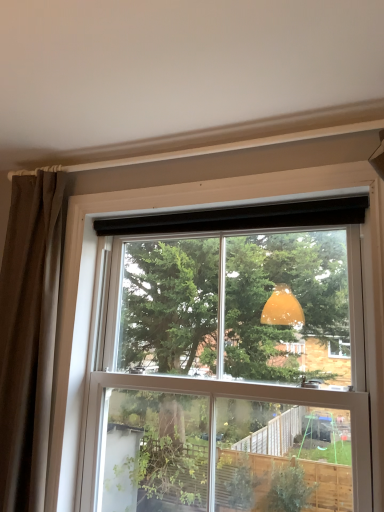
The width and height of the screenshot is (384, 512). I want to click on brown fabric curtain at left, so click(29, 334).

What do you see at coordinates (29, 334) in the screenshot? Image resolution: width=384 pixels, height=512 pixels. I see `brown fabric curtain at left` at bounding box center [29, 334].

Image resolution: width=384 pixels, height=512 pixels. What are the coordinates of `transparent glass window at upper center` in the screenshot? It's located at (179, 325).

What is the approximate width of transparent glass window at upper center?

transparent glass window at upper center is 26.08 centimeters in width.

This screenshot has width=384, height=512. Describe the element at coordinates (179, 325) in the screenshot. I see `transparent glass window at upper center` at that location.

This screenshot has width=384, height=512. Identify the location of brown fabric curtain at left. tap(29, 334).

Which object is positioned more to the left, transparent glass window at upper center or brown fabric curtain at left?

From the viewer's perspective, brown fabric curtain at left appears more on the left side.

Which object is closer to the camera, transparent glass window at upper center or brown fabric curtain at left?

transparent glass window at upper center is more forward.

Considering the positions of point (237, 447) and point (36, 240), is point (237, 447) closer or farther from the camera than point (36, 240)?

Point (237, 447) is closer to the camera than point (36, 240).

From the image's perspective, which one is positioned lower, transparent glass window at upper center or brown fabric curtain at left?

transparent glass window at upper center appears lower in the image.

From a real-world perspective, who is located lower, transparent glass window at upper center or brown fabric curtain at left?

In real-world perspective, transparent glass window at upper center is lower.

Which object is wider, transparent glass window at upper center or brown fabric curtain at left?

transparent glass window at upper center.

Does transparent glass window at upper center have a greater height compared to brown fabric curtain at left?

No.

Can you confirm if transparent glass window at upper center is smaller than brown fabric curtain at left?

No.

Is brown fabric curtain at left inside transparent glass window at upper center?

Actually, brown fabric curtain at left is outside transparent glass window at upper center.

Are transparent glass window at upper center and brown fabric curtain at left far apart?

No, there isn't a large distance between transparent glass window at upper center and brown fabric curtain at left.

Is transparent glass window at upper center oriented away from brown fabric curtain at left?

transparent glass window at upper center is not turned away from brown fabric curtain at left.

What's the angular difference between transparent glass window at upper center and brown fabric curtain at left's facing directions?

There is a 0.000675-degree angle between the facing directions of transparent glass window at upper center and brown fabric curtain at left.

How far apart are transparent glass window at upper center and brown fabric curtain at left?

transparent glass window at upper center and brown fabric curtain at left are 21.73 inches apart from each other.

Where is `curtain above the transparent glass window at upper center (from the image's perspective)`? The width and height of the screenshot is (384, 512). curtain above the transparent glass window at upper center (from the image's perspective) is located at coordinates (29, 334).

Considering the relative positions of brown fabric curtain at left and transparent glass window at upper center in the image provided, is brown fabric curtain at left to the left or to the right of transparent glass window at upper center?

Clearly, brown fabric curtain at left is on the left of transparent glass window at upper center in the image.

Is brown fabric curtain at left closer to the viewer compared to transparent glass window at upper center?

No, it is not.

Is point (41, 496) closer or farther from the camera than point (148, 247)?

Point (41, 496) is closer to the camera than point (148, 247).

From the image's perspective, is brown fabric curtain at left below transparent glass window at upper center?

No, from the image's perspective, brown fabric curtain at left is not beneath transparent glass window at upper center.

From a real-world perspective, is brown fabric curtain at left above or below transparent glass window at upper center?

Clearly, from a real-world perspective, brown fabric curtain at left is above transparent glass window at upper center.

Based on the photo, looking at their sizes, would you say brown fabric curtain at left is wider or thinner than transparent glass window at upper center?

Considering their sizes, brown fabric curtain at left looks slimmer than transparent glass window at upper center.

Can you confirm if brown fabric curtain at left is taller than transparent glass window at upper center?

Correct, brown fabric curtain at left is much taller as transparent glass window at upper center.

Between brown fabric curtain at left and transparent glass window at upper center, which one has smaller size?

With smaller size is brown fabric curtain at left.

Is transparent glass window at upper center located within brown fabric curtain at left?

That's incorrect, transparent glass window at upper center is not inside brown fabric curtain at left.

Is brown fabric curtain at left not close to transparent glass window at upper center?

Actually, brown fabric curtain at left and transparent glass window at upper center are a little close together.

Is brown fabric curtain at left oriented away from transparent glass window at upper center?

No, brown fabric curtain at left's orientation is not away from transparent glass window at upper center.

Consider the image. What's the angular difference between brown fabric curtain at left and transparent glass window at upper center's facing directions?

The angle between the facing direction of brown fabric curtain at left and the facing direction of transparent glass window at upper center is 0.000675 degrees.

Where is `curtain above the transparent glass window at upper center (from a real-world perspective)`? The width and height of the screenshot is (384, 512). curtain above the transparent glass window at upper center (from a real-world perspective) is located at coordinates (29, 334).

Where is `curtain behind the transparent glass window at upper center`? This screenshot has width=384, height=512. curtain behind the transparent glass window at upper center is located at coordinates (29, 334).

The height and width of the screenshot is (512, 384). Find the location of `window located underneath the brown fabric curtain at left (from a real-world perspective)`. window located underneath the brown fabric curtain at left (from a real-world perspective) is located at coordinates (179, 325).